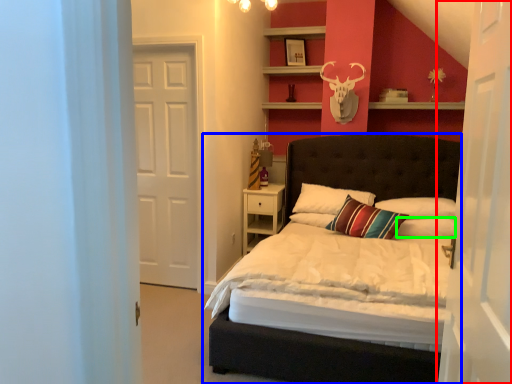
Question: Which object is the farthest from door (highlighted by a red box)? Choose among these: bed (highlighted by a blue box) or pillow (highlighted by a green box).

Choices:
 (A) bed
 (B) pillow

Answer: (A)